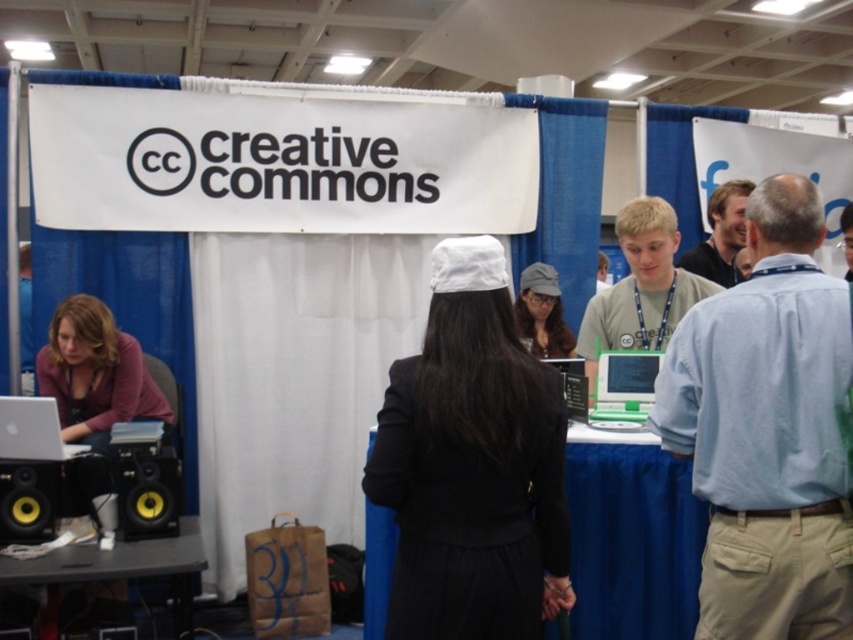
Question: Is blue fabric table at center behind matte gray cap at center?

Choices:
 (A) no
 (B) yes

Answer: (A)

Question: From the image, what is the correct spatial relationship of matte purple sweater at left in relation to black plastic table at lower left?

Choices:
 (A) right
 (B) left

Answer: (B)

Question: Among these objects, which one is farthest from the camera?

Choices:
 (A) light brown hair at upper right
 (B) light blue shirt at center
 (C) yellow/black speaker at lower left

Answer: (A)

Question: Which of the following is the farthest from the observer?

Choices:
 (A) (537, 300)
 (B) (646, 381)

Answer: (A)

Question: Is light blue shirt at center to the left of white matte hat at center from the viewer's perspective?

Choices:
 (A) yes
 (B) no

Answer: (B)

Question: Which point is farther from the camera taking this photo?

Choices:
 (A) (627, 518)
 (B) (555, 300)
 (C) (724, 294)

Answer: (B)